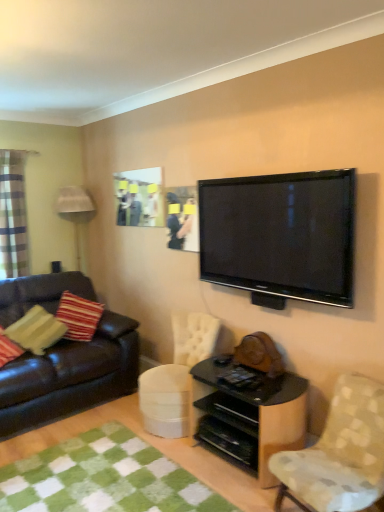
This screenshot has height=512, width=384. I want to click on free spot above green checkered rug at lower left (from a real-world perspective), so click(x=96, y=478).